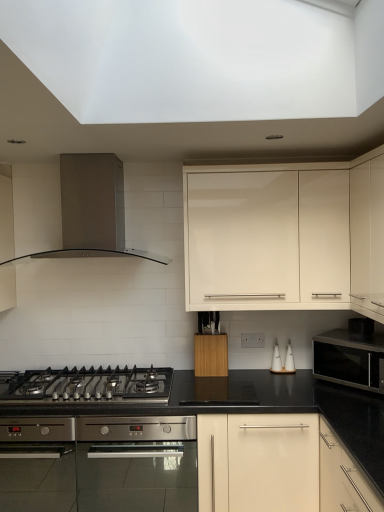
In the scene shown: Measure the distance between white ceramic salt shaker at center-right, the first appliance when ordered from left to right, and camera.

2.62 meters.

What do you see at coordinates (289, 359) in the screenshot? I see `white ceramic salt and pepper shakers at center-right, the second appliance viewed from the left` at bounding box center [289, 359].

Identify the location of white ceramic salt and pepper shakers at center-right, the 1th appliance in the right-to-left sequence. This screenshot has height=512, width=384. (289, 359).

Locate an element on the screen. wooden block at center, the first cabinetry positioned from the left is located at coordinates (211, 355).

What do you see at coordinates (211, 355) in the screenshot?
I see `wooden block at center, the 3th cabinetry in the right-to-left sequence` at bounding box center [211, 355].

What do you see at coordinates (92, 210) in the screenshot?
I see `stainless steel range hood at upper left` at bounding box center [92, 210].

Measure the distance between point (361, 189) and camera.

7.32 feet.

The width and height of the screenshot is (384, 512). Identify the location of white ceramic salt shaker at center-right, the first appliance when ordered from left to right. (276, 358).

Is there a large distance between matte cream cabinet at upper right, the 3th cabinetry viewed from the left, and white glossy cabinet at upper center, the second cabinetry viewed from the left?

No.

Is point (354, 288) in front of point (269, 292)?

Yes, point (354, 288) is closer to viewer.

Is matte cream cabinet at upper right, the first cabinetry from the right, oriented towards white glossy cabinet at upper center, placed as the 2th cabinetry when sorted from right to left?

Yes, matte cream cabinet at upper right, the first cabinetry from the right, is oriented towards white glossy cabinet at upper center, placed as the 2th cabinetry when sorted from right to left.

Does matte cream cabinet at upper right, the first cabinetry from the right, appear on the left side of white glossy cabinet at upper center, the second cabinetry viewed from the left?

No.

Which of these two, white glossy cabinet at upper center, placed as the 2th cabinetry when sorted from right to left, or matte cream cabinet at upper right, the first cabinetry from the right, stands taller?

With more height is matte cream cabinet at upper right, the first cabinetry from the right.

Looking at this image, is white glossy cabinet at upper center, the second cabinetry viewed from the left, facing away from matte cream cabinet at upper right, the 3th cabinetry viewed from the left?

No, white glossy cabinet at upper center, the second cabinetry viewed from the left,'s orientation is not away from matte cream cabinet at upper right, the 3th cabinetry viewed from the left.

Considering the sizes of white glossy cabinet at upper center, placed as the 2th cabinetry when sorted from right to left, and matte cream cabinet at upper right, the first cabinetry from the right, in the image, is white glossy cabinet at upper center, placed as the 2th cabinetry when sorted from right to left, wider or thinner than matte cream cabinet at upper right, the first cabinetry from the right,?

In the image, white glossy cabinet at upper center, placed as the 2th cabinetry when sorted from right to left, appears to be wider than matte cream cabinet at upper right, the first cabinetry from the right.

From the image's perspective, which object appears higher, white glossy cabinet at upper center, the second cabinetry viewed from the left, or matte cream cabinet at upper right, the first cabinetry from the right?

From the image's view, matte cream cabinet at upper right, the first cabinetry from the right, is above.

From the image's perspective, which one is positioned lower, stainless steel oven at center or white glossy cabinet at upper center, the second cabinetry viewed from the left?

stainless steel oven at center is shown below in the image.

Considering the positions of objects stainless steel oven at center and white glossy cabinet at upper center, placed as the 2th cabinetry when sorted from right to left, in the image provided, who is more to the right, stainless steel oven at center or white glossy cabinet at upper center, placed as the 2th cabinetry when sorted from right to left,?

From the viewer's perspective, white glossy cabinet at upper center, placed as the 2th cabinetry when sorted from right to left, appears more on the right side.

Between stainless steel oven at center and white glossy cabinet at upper center, placed as the 2th cabinetry when sorted from right to left, which one has larger width?

With larger width is stainless steel oven at center.

From the picture: Is stainless steel oven at center looking in the opposite direction of white glossy cabinet at upper center, placed as the 2th cabinetry when sorted from right to left?

No, white glossy cabinet at upper center, placed as the 2th cabinetry when sorted from right to left, is not at the back of stainless steel oven at center.

Can you confirm if white ceramic salt and pepper shakers at center-right, the 1th appliance in the right-to-left sequence, is taller than white ceramic salt shaker at center-right, the first appliance when ordered from left to right?

No, white ceramic salt and pepper shakers at center-right, the 1th appliance in the right-to-left sequence, is not taller than white ceramic salt shaker at center-right, the first appliance when ordered from left to right.

Based on their sizes in the image, would you say white ceramic salt and pepper shakers at center-right, the second appliance viewed from the left, is bigger or smaller than white ceramic salt shaker at center-right, the first appliance when ordered from left to right?

Considering their sizes, white ceramic salt and pepper shakers at center-right, the second appliance viewed from the left, takes up more space than white ceramic salt shaker at center-right, the first appliance when ordered from left to right.

Does white ceramic salt and pepper shakers at center-right, the 1th appliance in the right-to-left sequence, turn towards white ceramic salt shaker at center-right, the first appliance when ordered from left to right?

No, white ceramic salt and pepper shakers at center-right, the 1th appliance in the right-to-left sequence, is not aimed at white ceramic salt shaker at center-right, the first appliance when ordered from left to right.

Which object is closer to the camera, white ceramic salt and pepper shakers at center-right, the second appliance viewed from the left, or white ceramic salt shaker at center-right, the 2th appliance when ordered from right to left?

white ceramic salt and pepper shakers at center-right, the second appliance viewed from the left, is in front.

Find the location of `kitchen appliance to the left of white ceramic salt shaker at center-right, the 2th appliance when ordered from right to left`. kitchen appliance to the left of white ceramic salt shaker at center-right, the 2th appliance when ordered from right to left is located at coordinates (92, 210).

Is stainless steel range hood at upper left aimed at white ceramic salt shaker at center-right, the first appliance when ordered from left to right?

No, stainless steel range hood at upper left does not turn towards white ceramic salt shaker at center-right, the first appliance when ordered from left to right.

Is stainless steel range hood at upper left inside the boundaries of white ceramic salt shaker at center-right, the 2th appliance when ordered from right to left, or outside?

The correct answer is: outside.

From the picture: Which of these two, stainless steel range hood at upper left or white ceramic salt shaker at center-right, the 2th appliance when ordered from right to left, is wider?

Wider between the two is stainless steel range hood at upper left.

Does black stainless steel gas stove at lower left come behind satin black microwave at right?

Yes, black stainless steel gas stove at lower left is behind satin black microwave at right.

In the scene shown: Between black stainless steel gas stove at lower left and satin black microwave at right, which one has smaller size?

Smaller between the two is black stainless steel gas stove at lower left.

You are a GUI agent. You are given a task and a screenshot of the screen. Output one action in this format:
    pyautogui.click(x=<x>, y=<y>)
    Task: Click on the gas stove that appears on the left of satin black microwave at right
    
    Given the screenshot: What is the action you would take?
    pyautogui.click(x=89, y=385)

Measure the distance from black stainless steel gas stove at lower left to satin black microwave at right.

black stainless steel gas stove at lower left is 3.75 feet away from satin black microwave at right.

Is wooden block at center, the first cabinetry positioned from the left, completely or partially outside of white ceramic salt shaker at center-right, the 2th appliance when ordered from right to left?

Absolutely, wooden block at center, the first cabinetry positioned from the left, is external to white ceramic salt shaker at center-right, the 2th appliance when ordered from right to left.

Is wooden block at center, the 3th cabinetry in the right-to-left sequence, oriented towards white ceramic salt shaker at center-right, the first appliance when ordered from left to right?

No, wooden block at center, the 3th cabinetry in the right-to-left sequence, is not turned towards white ceramic salt shaker at center-right, the first appliance when ordered from left to right.

Does wooden block at center, the 3th cabinetry in the right-to-left sequence, have a lesser height compared to white ceramic salt shaker at center-right, the first appliance when ordered from left to right?

Incorrect, the height of wooden block at center, the 3th cabinetry in the right-to-left sequence, does not fall short of that of white ceramic salt shaker at center-right, the first appliance when ordered from left to right.

Which of these two, wooden block at center, the first cabinetry positioned from the left, or white ceramic salt shaker at center-right, the 2th appliance when ordered from right to left, is bigger?

Bigger between the two is wooden block at center, the first cabinetry positioned from the left.

The width and height of the screenshot is (384, 512). I want to click on cabinetry that is the 1st one when counting leftward from the matte cream cabinet at upper right, the first cabinetry from the right, so click(285, 234).

From a real-world perspective, which cabinetry is the 1st one underneath the matte cream cabinet at upper right, the first cabinetry from the right? Please provide its 2D coordinates.

[(285, 234)]

Based on their spatial positions, is wooden block at center, the first cabinetry positioned from the left, or satin black microwave at right further from white ceramic salt and pepper shakers at center-right, the second appliance viewed from the left?

wooden block at center, the first cabinetry positioned from the left, lies further to white ceramic salt and pepper shakers at center-right, the second appliance viewed from the left, than the other object.

Based on their spatial positions, is white ceramic salt and pepper shakers at center-right, the 1th appliance in the right-to-left sequence, or matte cream cabinet at upper right, the 3th cabinetry viewed from the left, closer to wooden block at center, the first cabinetry positioned from the left?

white ceramic salt and pepper shakers at center-right, the 1th appliance in the right-to-left sequence.

From the image, which object appears to be farther from black stainless steel gas stove at lower left, white glossy cabinet at upper center, placed as the 2th cabinetry when sorted from right to left, or matte cream cabinet at upper right, the 3th cabinetry viewed from the left?

matte cream cabinet at upper right, the 3th cabinetry viewed from the left, is further to black stainless steel gas stove at lower left.

From the image, which object appears to be farther from white ceramic salt and pepper shakers at center-right, the second appliance viewed from the left, matte cream cabinet at upper right, the first cabinetry from the right, or black stainless steel gas stove at lower left?

The object further to white ceramic salt and pepper shakers at center-right, the second appliance viewed from the left, is black stainless steel gas stove at lower left.

In the scene shown: Looking at the image, which one is located further to matte cream cabinet at upper right, the first cabinetry from the right, wooden block at center, the 3th cabinetry in the right-to-left sequence, or stainless steel range hood at upper left?

Based on the image, stainless steel range hood at upper left appears to be further to matte cream cabinet at upper right, the first cabinetry from the right.

Which object lies further to the anchor point satin black microwave at right, black stainless steel gas stove at lower left or stainless steel range hood at upper left?

stainless steel range hood at upper left.

Considering their positions, is white ceramic salt shaker at center-right, the first appliance when ordered from left to right, positioned further to white ceramic salt and pepper shakers at center-right, the 1th appliance in the right-to-left sequence, than matte cream cabinet at upper right, the 3th cabinetry viewed from the left?

matte cream cabinet at upper right, the 3th cabinetry viewed from the left, is further to white ceramic salt and pepper shakers at center-right, the 1th appliance in the right-to-left sequence.

Looking at the image, which one is located closer to stainless steel oven at center, white ceramic salt and pepper shakers at center-right, the second appliance viewed from the left, or white ceramic salt shaker at center-right, the first appliance when ordered from left to right?

white ceramic salt shaker at center-right, the first appliance when ordered from left to right.

This screenshot has height=512, width=384. I want to click on microwave oven between stainless steel oven at center and matte cream cabinet at upper right, the first cabinetry from the right, in the horizontal direction, so click(x=350, y=359).

Find the location of a particular element. The height and width of the screenshot is (512, 384). gas stove located between stainless steel range hood at upper left and satin black microwave at right in the left-right direction is located at coordinates (89, 385).

The height and width of the screenshot is (512, 384). Identify the location of gas stove located between stainless steel range hood at upper left and white ceramic salt and pepper shakers at center-right, the second appliance viewed from the left, in the left-right direction. (89, 385).

The width and height of the screenshot is (384, 512). Identify the location of appliance between stainless steel oven at center and white ceramic salt and pepper shakers at center-right, the 1th appliance in the right-to-left sequence, in the horizontal direction. (276, 358).